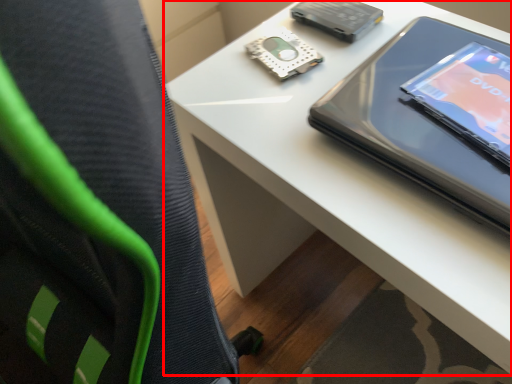
Question: In this image, where is table (annotated by the red box) located relative to tablet computer?

Choices:
 (A) right
 (B) left

Answer: (B)